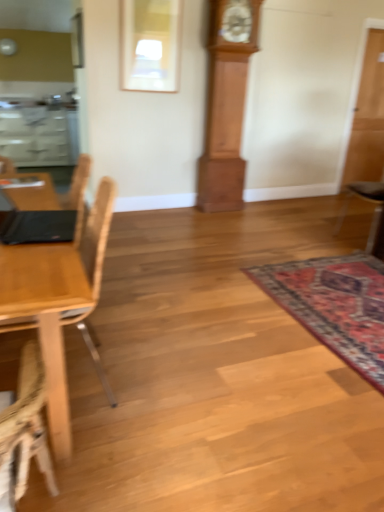
Question: Considering the relative sizes of black leather chair at right, the second chair from the left, and light wood chair at left, marked as the 1th chair in a front-to-back arrangement, in the image provided, is black leather chair at right, the second chair from the left, thinner than light wood chair at left, marked as the 1th chair in a front-to-back arrangement,?

Choices:
 (A) no
 (B) yes

Answer: (A)

Question: Is black leather chair at right, which is counted as the first chair, starting from the right, far from light wood chair at left, the 1th chair from the left?

Choices:
 (A) no
 (B) yes

Answer: (B)

Question: From a real-world perspective, is black leather chair at right, which ranks as the first chair in back-to-front order, on top of light wood chair at left, which is counted as the second chair, starting from the right?

Choices:
 (A) yes
 (B) no

Answer: (A)

Question: Does black leather chair at right, the second chair from the left, come in front of light wood chair at left, which appears as the second chair when viewed from the back?

Choices:
 (A) yes
 (B) no

Answer: (B)

Question: Can you confirm if black leather chair at right, which ranks as the first chair in back-to-front order, is positioned to the right of light wood chair at left, the 1th chair from the left?

Choices:
 (A) no
 (B) yes

Answer: (B)

Question: From a real-world perspective, is black leather chair at right, marked as the 2th chair in a front-to-back arrangement, physically below light wood chair at left, the 1th chair from the left?

Choices:
 (A) no
 (B) yes

Answer: (A)

Question: Is transparent glass door at right taller than carpeted rug at lower right?

Choices:
 (A) no
 (B) yes

Answer: (B)

Question: From the image's perspective, is transparent glass door at right located beneath carpeted rug at lower right?

Choices:
 (A) yes
 (B) no

Answer: (B)

Question: From the image's perspective, is transparent glass door at right on top of carpeted rug at lower right?

Choices:
 (A) no
 (B) yes

Answer: (B)

Question: Considering the relative sizes of transparent glass door at right and carpeted rug at lower right in the image provided, is transparent glass door at right smaller than carpeted rug at lower right?

Choices:
 (A) no
 (B) yes

Answer: (A)

Question: Considering the relative sizes of transparent glass door at right and carpeted rug at lower right in the image provided, is transparent glass door at right thinner than carpeted rug at lower right?

Choices:
 (A) yes
 (B) no

Answer: (A)

Question: Considering the relative sizes of transparent glass door at right and carpeted rug at lower right in the image provided, is transparent glass door at right bigger than carpeted rug at lower right?

Choices:
 (A) no
 (B) yes

Answer: (B)

Question: Is carpeted rug at lower right bigger than black leather chair at right, marked as the 2th chair in a front-to-back arrangement?

Choices:
 (A) yes
 (B) no

Answer: (B)